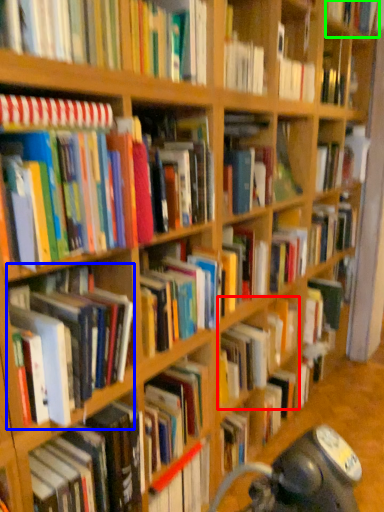
Question: Based on their relative distances, which object is nearer to book (highlighted by a red box)? Choose from book (highlighted by a blue box) and book (highlighted by a green box).

Choices:
 (A) book
 (B) book

Answer: (A)